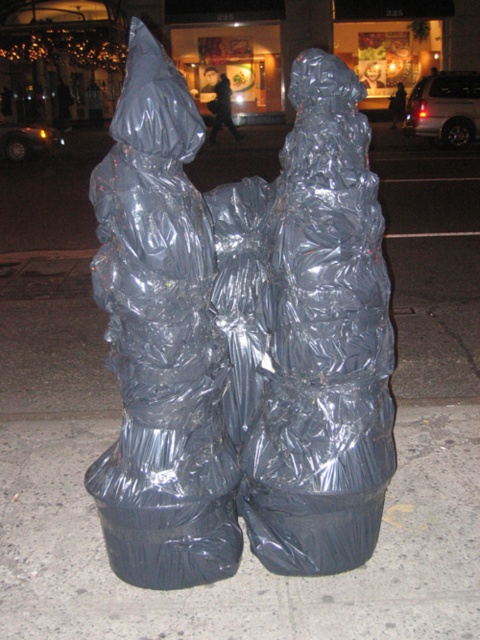
You are a delivery person who needs to deliver a package to the clear plastic sculpture at center. The sculpture is located at point (311,333). Based on the scene description, can you confirm the sculpture is visible and accessible for delivery?

The clear plastic sculpture at center is visible and accessible for delivery as it is located at point (311,333), which is the center of the image. The scene describes the sculpture as being on a sidewalk at night with no obstructions mentioned, so delivery should be possible.

You are a photographer trying to capture the clear plastic sculpture at center and the satin silver sculpture at center. Since both are at the center, which one would appear closer to the camera?

The clear plastic sculpture at center is in front of the satin silver sculpture at center, so it would appear closer to the camera.

You are a delivery person who needs to place a package on the sidewalk. The package is 0.5 meters wide. There is a point marked at coordinates (243, 548) on the black plastic bags at center. Can you place the package so that its center aligns with this point without overlapping any of the figures?

The point (243, 548) is on the black plastic bags at center. Since the package is 0.5 meters wide, placing its center at this point would require checking the distance from the figures. However, the description does not provide information about the distance between the black plastic bags and the figures. Therefore, it is uncertain if the package would overlap the figures.